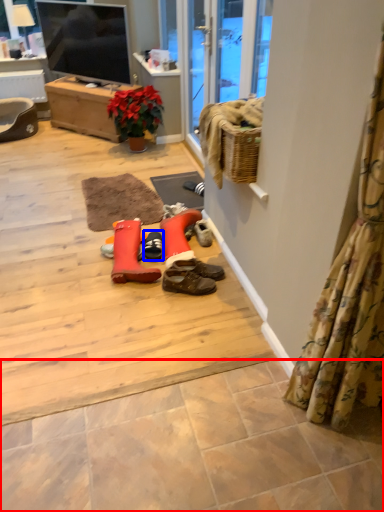
Question: Which object is closer to the camera taking this photo, tile (highlighted by a red box) or footwear (highlighted by a blue box)?

Choices:
 (A) tile
 (B) footwear

Answer: (A)